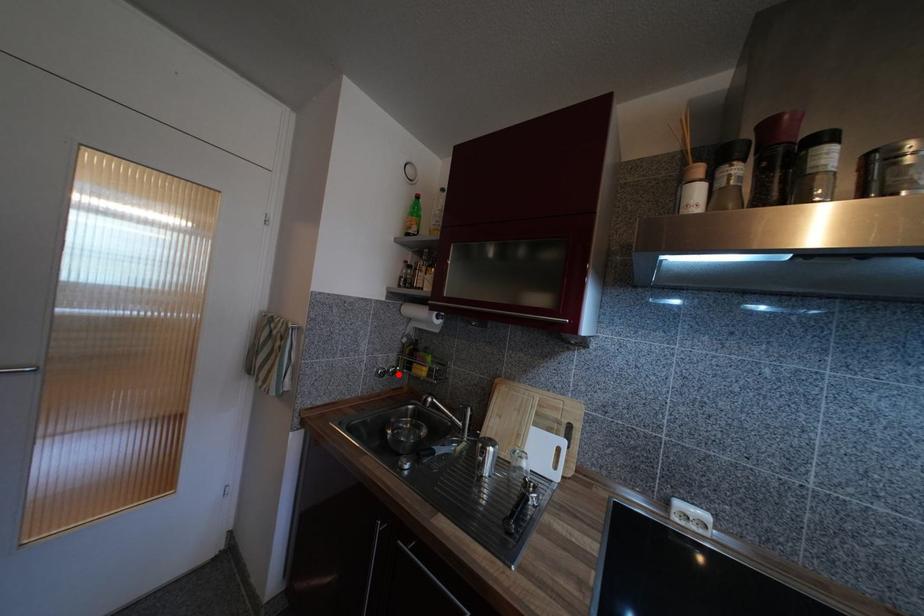
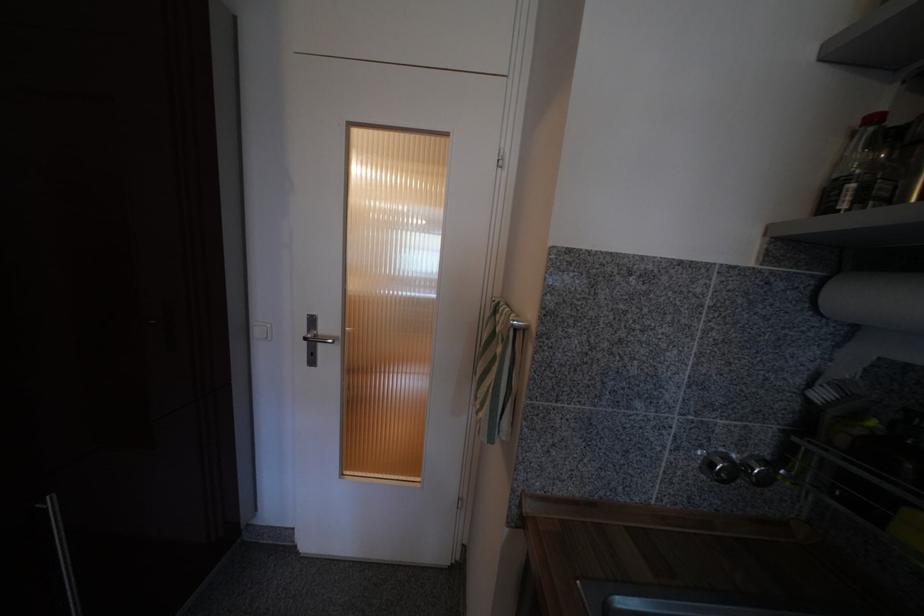
Question: I am providing you with two images of the same scene from different viewpoints. A red point is marked on the first image. Is the red point's position out of view in image 2?

Choices:
 (A) Yes
 (B) No

Answer: (B)